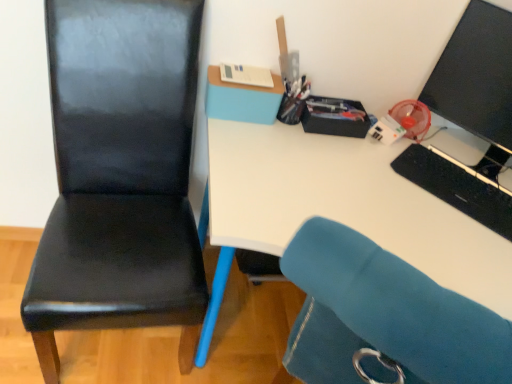
Where is `vacant space in front of metallic pen holder at upper center, which appears as the 2th stationery when viewed from the left`? This screenshot has height=384, width=512. vacant space in front of metallic pen holder at upper center, which appears as the 2th stationery when viewed from the left is located at coordinates (280, 145).